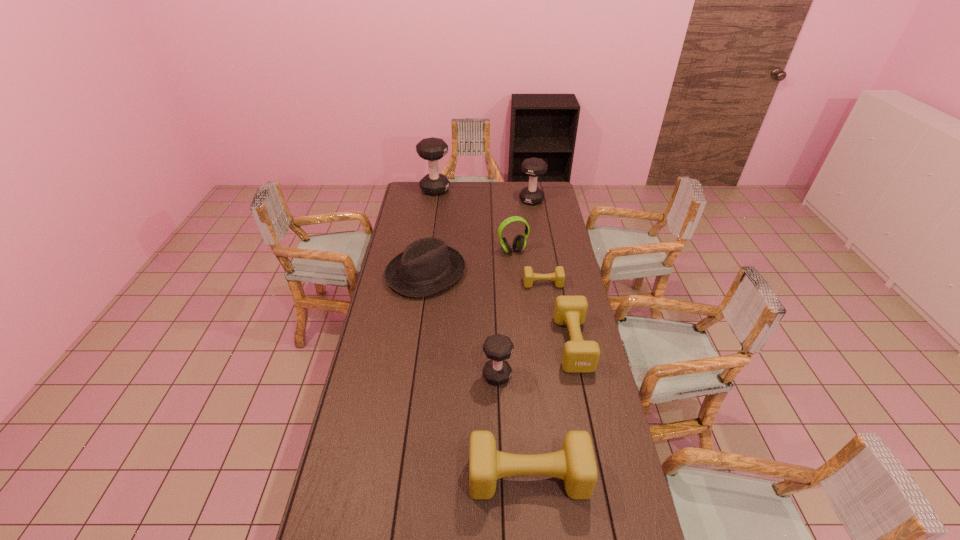
You are a GUI agent. You are given a task and a screenshot of the screen. Output one action in this format:
    pyautogui.click(x=<x>, y=<y>)
    Task: Click on the leftmost dumbbell
    The width and height of the screenshot is (960, 540).
    Given the screenshot: What is the action you would take?
    pyautogui.click(x=432, y=149)

Where is `the biggest gray dumbbell`? the biggest gray dumbbell is located at coordinates (432, 149).

The width and height of the screenshot is (960, 540). I want to click on the second smallest gray dumbbell, so click(533, 167).

You are a GUI agent. You are given a task and a screenshot of the screen. Output one action in this format:
    pyautogui.click(x=<x>, y=<y>)
    Task: Click on the rightmost gray dumbbell
    
    Given the screenshot: What is the action you would take?
    pyautogui.click(x=533, y=167)

Where is `green headset`? green headset is located at coordinates (519, 242).

You are a GUI agent. You are given a task and a screenshot of the screen. Output one action in this format:
    pyautogui.click(x=<x>, y=<y>)
    Task: Click on the smallest gray dumbbell
    This screenshot has width=960, height=540.
    Given the screenshot: What is the action you would take?
    pyautogui.click(x=498, y=348)

Find the location of a particular element. The height and width of the screenshot is (540, 960). the second gray dumbbell from left to right is located at coordinates (498, 348).

Where is `gray fedora`? Image resolution: width=960 pixels, height=540 pixels. gray fedora is located at coordinates (427, 266).

Identify the location of the biggest olive dumbbell. (575, 464).

I want to click on the nearest dumbbell, so click(575, 464).